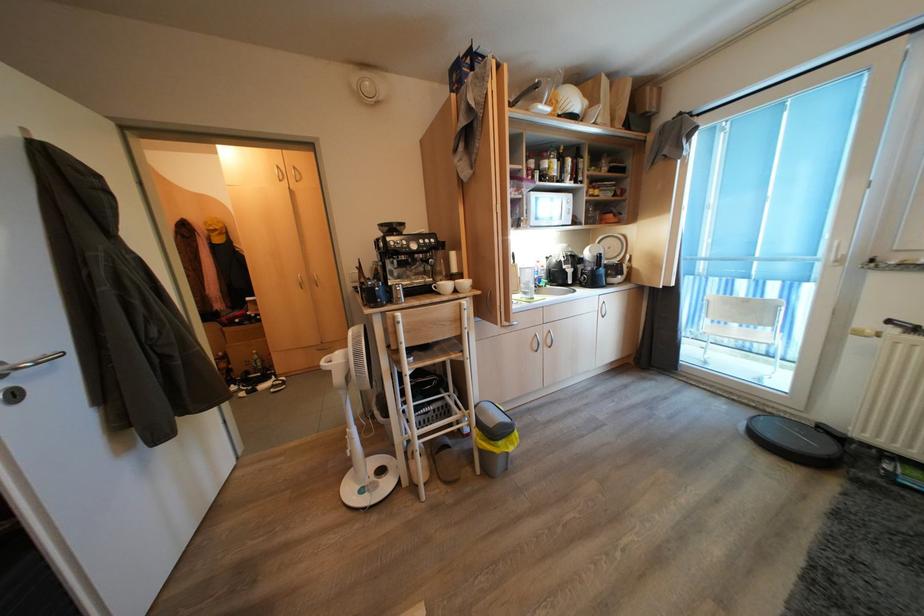
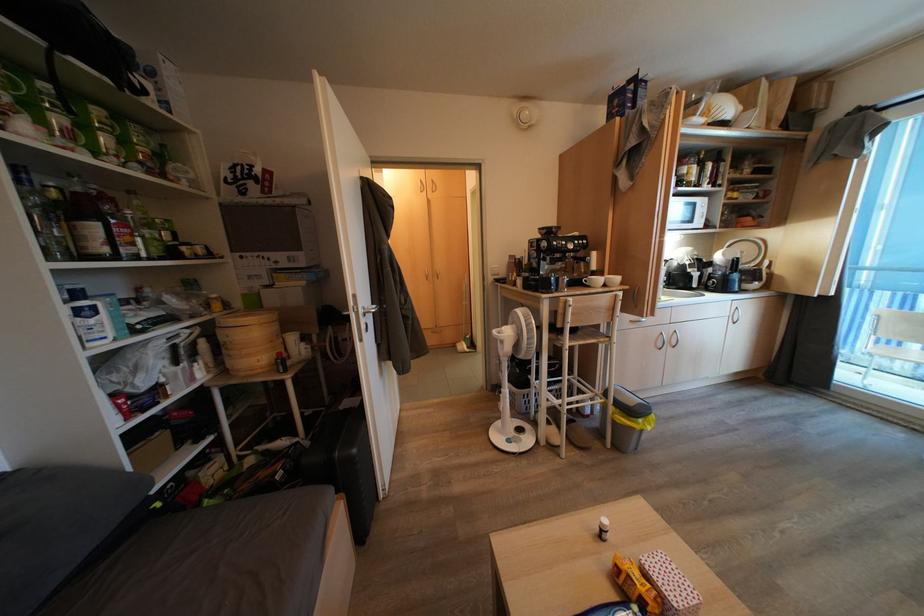
The point at (548, 349) is marked in the first image. Where is the corresponding point in the second image?

(672, 347)